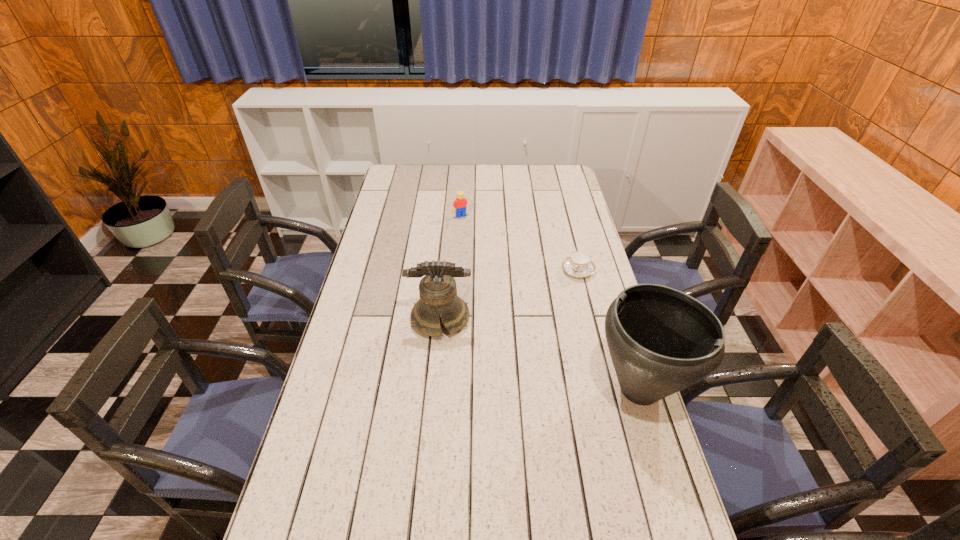
The width and height of the screenshot is (960, 540). What are the coordinates of `free space located 0.310m on the face of the second shortest object` in the screenshot? It's located at (493, 261).

The image size is (960, 540). Find the location of `vacant space located 0.360m on the face of the second shortest object`. vacant space located 0.360m on the face of the second shortest object is located at coordinates [498, 269].

Identify the location of vacant space positioned on the face of the second shortest object. (487, 252).

The width and height of the screenshot is (960, 540). Find the location of `vacant area situated 0.290m on the side with the handle of the shortest object`. vacant area situated 0.290m on the side with the handle of the shortest object is located at coordinates (544, 335).

Find the location of a particular element. vacant area located on the side with the handle of the shortest object is located at coordinates (555, 315).

At what (x,y) coordinates should I click in order to perform the action: click on free point located on the side with the handle of the shortest object. Please return your answer as a coordinate pair (x, y). This screenshot has height=540, width=960. Looking at the image, I should click on (542, 338).

The image size is (960, 540). What are the coordinates of `urn that is positioned at the right edge` in the screenshot? It's located at (661, 340).

I want to click on teacup located at the right edge, so click(x=579, y=264).

Locate an element on the screen. The image size is (960, 540). vacant space at the far edge of the desktop is located at coordinates (535, 171).

Identify the location of vacant space at the left edge of the desktop. (335, 367).